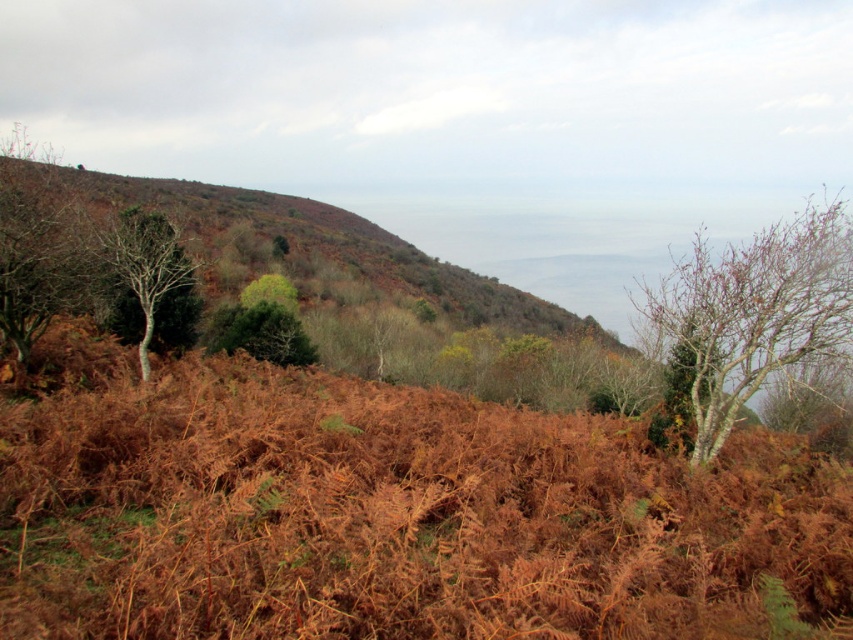
You are standing in the middle of the hillside and see the bare wood tree at right and the green matte tree at left. Which tree is positioned to the right side of the other?

The bare wood tree at right is positioned to the right of the green matte tree at left.

You are standing at the point marked as point (755, 310) in the image. What can you see at that location?

At point (755, 310) lies a bare wood tree at right.